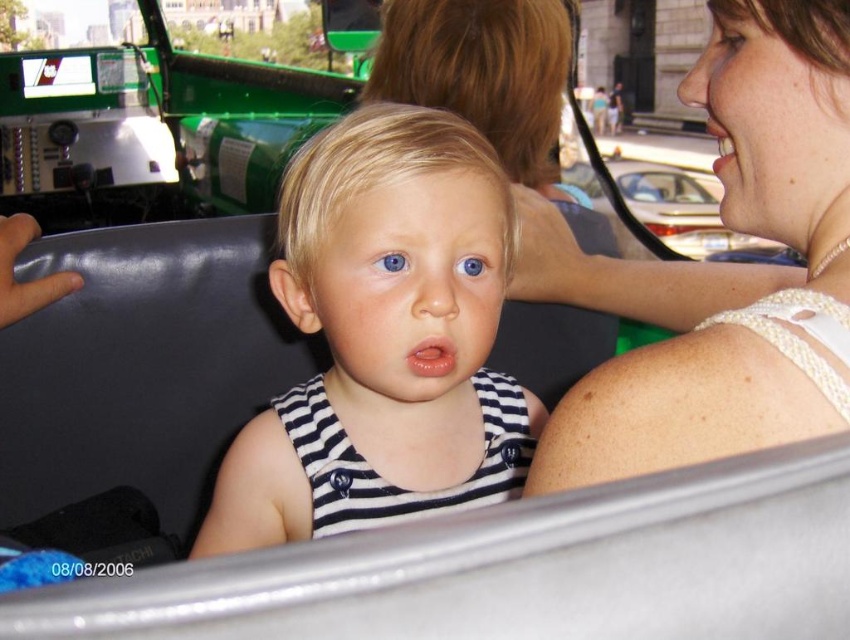
Question: Which object is positioned closest to the metallic silver car at upper right?

Choices:
 (A) pearl-like fabric top at upper right
 (B) blue matte eye at center
 (C) white striped tank top at center
 (D) blue smooth eye at center

Answer: (C)

Question: Which is farther from the pearl-like fabric top at upper right?

Choices:
 (A) blue matte eye at center
 (B) blue smooth eye at center
 (C) white striped tank top at center
 (D) metallic silver car at upper right

Answer: (D)

Question: Does blue smooth eye at center have a smaller size compared to blue matte eye at center?

Choices:
 (A) yes
 (B) no

Answer: (A)

Question: Considering the relative positions of pearl-like fabric top at upper right and metallic silver car at upper right in the image provided, where is pearl-like fabric top at upper right located with respect to metallic silver car at upper right?

Choices:
 (A) left
 (B) right

Answer: (A)

Question: Is pearl-like fabric top at upper right to the left of metallic silver car at upper right from the viewer's perspective?

Choices:
 (A) no
 (B) yes

Answer: (B)

Question: Which object is the farthest from the metallic silver car at upper right?

Choices:
 (A) white striped tank top at center
 (B) pearl-like fabric top at upper right
 (C) blue matte eye at center

Answer: (C)